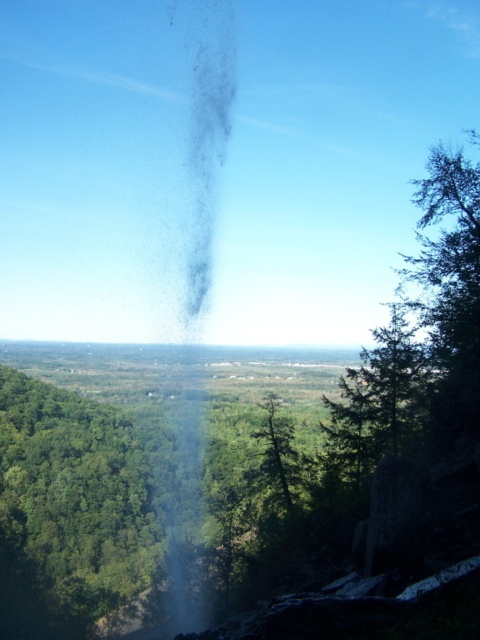
You are a hiker who wants to cross the valley. You see the smoketransparentat center and the green matte tree at center. Which object is closer to your current position?

The green matte tree at center is closer to your current position because it is positioned in the foreground, while the smoketransparentat center is further away in the background.

You are an artist trying to paint this scene. You have a limited amount of green paint. Which object should you use less paint on, the green leafy tree at left or the smoketransparentat center?

The green leafy tree at left occupies less space than smoketransparentat center, so you should use less green paint on the green leafy tree at left.